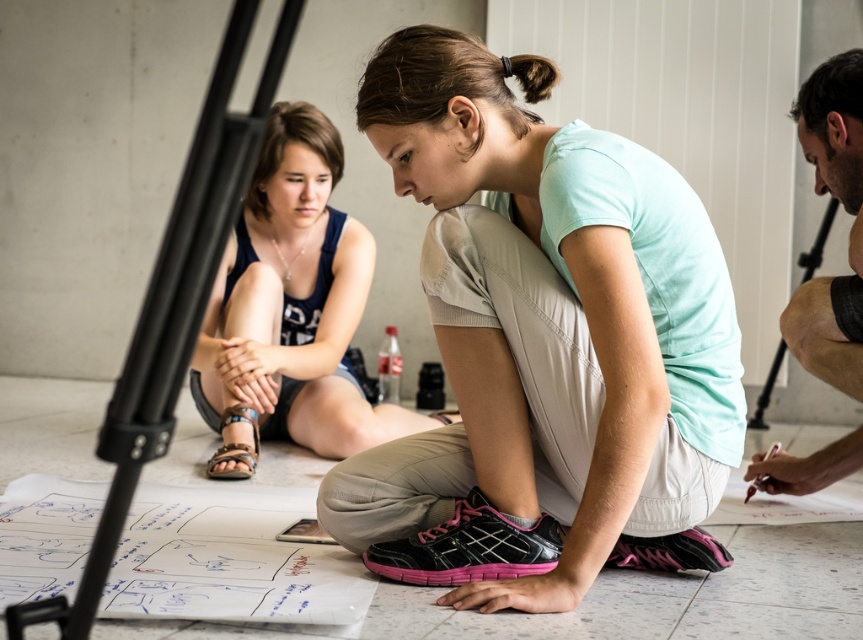
You are standing at the origin point in the center of the image. Which of the two points, point (558,156) or point (228,461), is closer to you?

Point (558,156) is in front of point (228,461), so it is closer to you.

Consider the image. You are a photographer positioned at the back of the room. You want to take a photo of the matte light blue shirt at center and the smooth skin man at right. Can you see both subjects clearly without any obstruction?

The matte light blue shirt at center is in front of the smooth skin man at right, so the smooth skin man at right may be partially obscured by the matte light blue shirt at center. Therefore, you might not be able to see both subjects clearly without any obstruction.